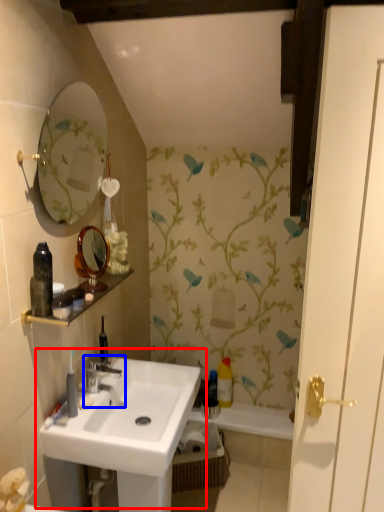
Question: Which of the following is the closest to the observer, sink (highlighted by a red box) or tap (highlighted by a blue box)?

Choices:
 (A) sink
 (B) tap

Answer: (A)